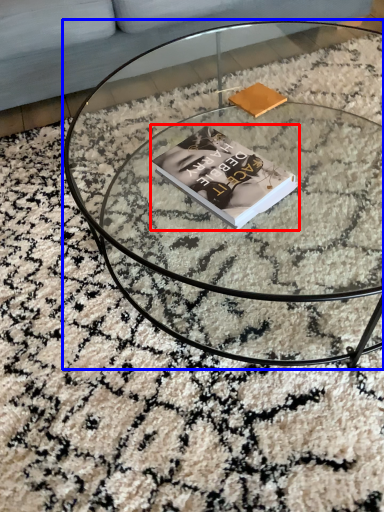
Question: Which of the following is the closest to the observer, book (highlighted by a red box) or coffee table (highlighted by a blue box)?

Choices:
 (A) book
 (B) coffee table

Answer: (B)